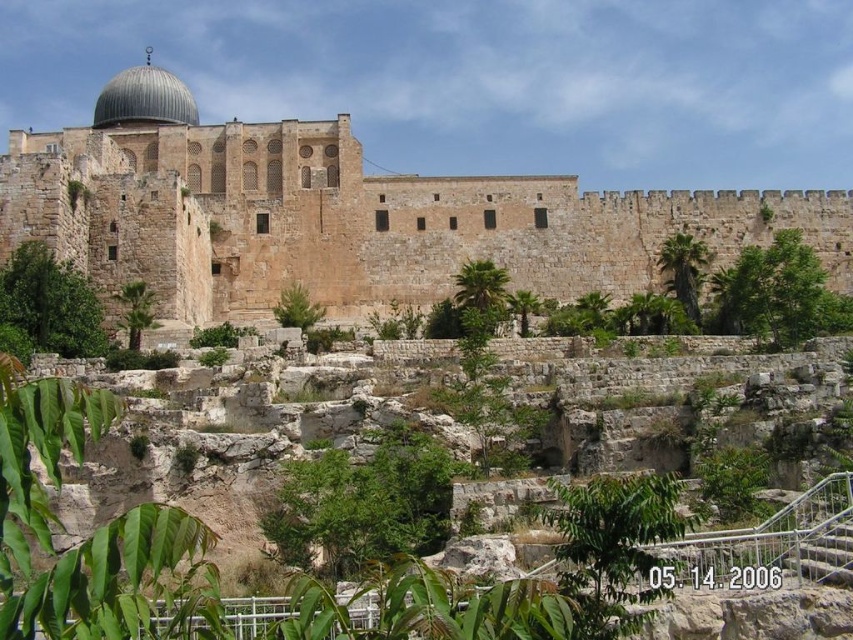
Question: Is brown stone castle at upper center further to the viewer compared to shiny silver dome at upper left?

Choices:
 (A) no
 (B) yes

Answer: (A)

Question: Which object is farther from the camera taking this photo?

Choices:
 (A) brown stone castle at upper center
 (B) shiny silver dome at upper left

Answer: (B)

Question: Which point appears farthest from the camera in this image?

Choices:
 (A) (173, 248)
 (B) (137, 108)

Answer: (B)

Question: Among these points, which one is farthest from the camera?

Choices:
 (A) (135, 113)
 (B) (430, 212)

Answer: (A)

Question: Is brown stone castle at upper center to the right of shiny silver dome at upper left from the viewer's perspective?

Choices:
 (A) yes
 (B) no

Answer: (A)

Question: Is brown stone castle at upper center to the left of shiny silver dome at upper left from the viewer's perspective?

Choices:
 (A) yes
 (B) no

Answer: (B)